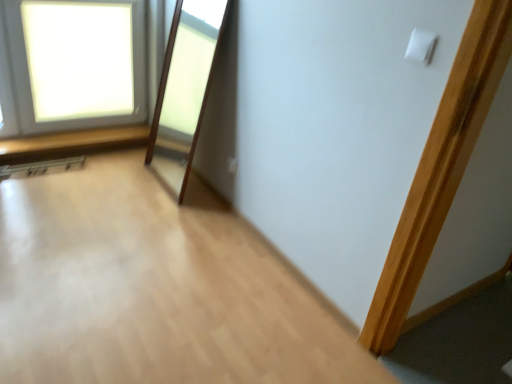
What is the approximate width of white frosted glass window at upper left?

white frosted glass window at upper left is 4.86 inches in width.

Measure the distance between point (232,158) and camera.

The depth of point (232,158) is 2.39 meters.

Identify the location of white matte light switch at upper right. (421, 46).

The width and height of the screenshot is (512, 384). What do you see at coordinates (421, 46) in the screenshot?
I see `white matte light switch at upper right` at bounding box center [421, 46].

Locate an element on the screen. white frosted glass window at upper left is located at coordinates click(x=76, y=63).

Which object is more forward, white plastic electric outlet at upper center or white matte light switch at upper right?

white matte light switch at upper right.

Can we say white plastic electric outlet at upper center lies outside white matte light switch at upper right?

That's correct, white plastic electric outlet at upper center is outside of white matte light switch at upper right.

Could you tell me if white plastic electric outlet at upper center is facing white matte light switch at upper right?

No.

From the picture: Based on their positions, is white plastic electric outlet at upper center located to the left or right of white matte light switch at upper right?

white plastic electric outlet at upper center is to the left of white matte light switch at upper right.

Is white plastic electric outlet at upper center positioned with its back to white frosted glass window at upper left?

That's not correct — white plastic electric outlet at upper center is not looking away from white frosted glass window at upper left.

What are the coordinates of `window above the white plastic electric outlet at upper center (from a real-world perspective)` in the screenshot? It's located at (76, 63).

Does white plastic electric outlet at upper center come behind white frosted glass window at upper left?

That is True.

Who is bigger, white plastic electric outlet at upper center or white frosted glass window at upper left?

white frosted glass window at upper left.

Is white frosted glass window at upper left aimed at white plastic electric outlet at upper center?

Yes, white frosted glass window at upper left is facing white plastic electric outlet at upper center.

Considering the positions of objects white frosted glass window at upper left and white plastic electric outlet at upper center in the image provided, who is more to the left, white frosted glass window at upper left or white plastic electric outlet at upper center?

From the viewer's perspective, white frosted glass window at upper left appears more on the left side.

From a real-world perspective, is white frosted glass window at upper left on white plastic electric outlet at upper center?

Yes.

Is point (22, 3) closer to viewer compared to point (412, 36)?

No, (22, 3) is further to viewer.

Between white frosted glass window at upper left and white matte light switch at upper right, which one appears on the right side from the viewer's perspective?

From the viewer's perspective, white matte light switch at upper right appears more on the right side.

This screenshot has height=384, width=512. I want to click on light switch above the white frosted glass window at upper left (from a real-world perspective), so (421, 46).

In the image, is white frosted glass window at upper left positioned in front of or behind white matte light switch at upper right?

Visually, white frosted glass window at upper left is located behind white matte light switch at upper right.

Could you measure the distance between white matte light switch at upper right and white plastic electric outlet at upper center?

white matte light switch at upper right is 1.25 meters from white plastic electric outlet at upper center.

Which is behind, point (410, 50) or point (236, 166)?

Positioned behind is point (236, 166).

Is white matte light switch at upper right wider than white plastic electric outlet at upper center?

No, white matte light switch at upper right is not wider than white plastic electric outlet at upper center.

Is white matte light switch at upper right located outside white plastic electric outlet at upper center?

Yes.

How different are the orientations of white matte light switch at upper right and white frosted glass window at upper left in degrees?

89.9 degrees.

Does white matte light switch at upper right lie behind white frosted glass window at upper left?

No, it is not.

Is white matte light switch at upper right far from white frosted glass window at upper left?

Yes, white matte light switch at upper right and white frosted glass window at upper left are located far from each other.

Which is farther from the camera, (412, 59) or (124, 7)?

The point (124, 7) is behind.

The width and height of the screenshot is (512, 384). Identify the location of electric outlet behind the white matte light switch at upper right. (232, 165).

Identify the location of electric outlet located below the white frosted glass window at upper left (from the image's perspective). Image resolution: width=512 pixels, height=384 pixels. (232, 165).

Based on their spatial positions, is white frosted glass window at upper left or white plastic electric outlet at upper center further from white matte light switch at upper right?

Among the two, white frosted glass window at upper left is located further to white matte light switch at upper right.

Based on their spatial positions, is white plastic electric outlet at upper center or white matte light switch at upper right further from white frosted glass window at upper left?

white matte light switch at upper right is positioned further to the anchor white frosted glass window at upper left.

In the scene shown: Looking at the image, which one is located closer to white frosted glass window at upper left, white matte light switch at upper right or white plastic electric outlet at upper center?

white plastic electric outlet at upper center.

Based on their spatial positions, is white frosted glass window at upper left or white matte light switch at upper right closer to white plastic electric outlet at upper center?

white matte light switch at upper right.

When comparing their distances from white plastic electric outlet at upper center, does white matte light switch at upper right or white frosted glass window at upper left seem closer?

The object closer to white plastic electric outlet at upper center is white matte light switch at upper right.

Looking at the image, which one is located further to white matte light switch at upper right, white plastic electric outlet at upper center or white frosted glass window at upper left?

white frosted glass window at upper left lies further to white matte light switch at upper right than the other object.

Locate an element on the screen. The height and width of the screenshot is (384, 512). electric outlet located between white frosted glass window at upper left and white matte light switch at upper right in the left-right direction is located at coordinates (232, 165).